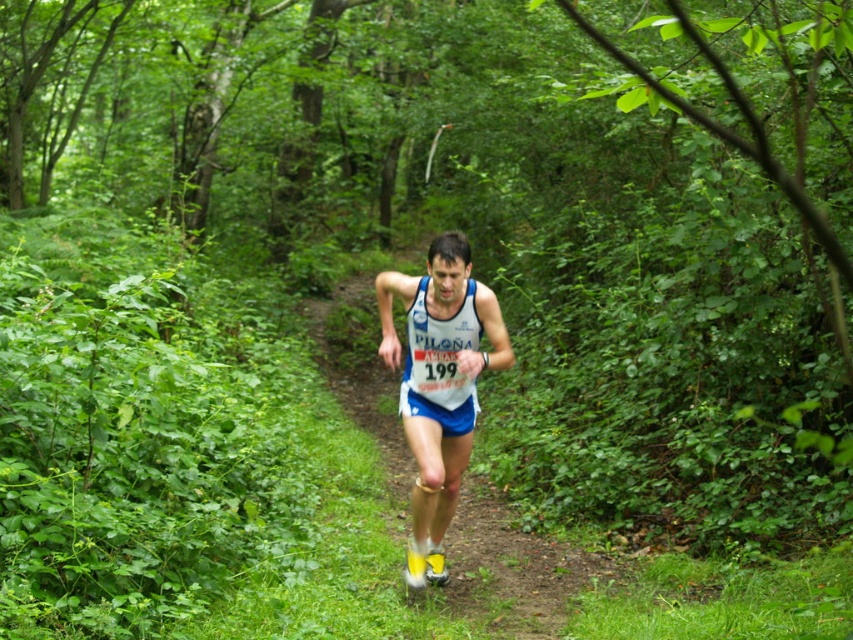
Question: Observing the image, what is the correct spatial positioning of blue fabric runner at center in reference to white fabric runner at center?

Choices:
 (A) below
 (B) above

Answer: (A)

Question: Is blue fabric runner at center wider than white fabric runner at center?

Choices:
 (A) no
 (B) yes

Answer: (B)

Question: Which point appears closest to the camera in this image?

Choices:
 (A) (502, 570)
 (B) (432, 531)

Answer: (B)

Question: Which of the following is the closest to the observer?

Choices:
 (A) (415, 285)
 (B) (509, 579)

Answer: (A)

Question: Is blue fabric runner at center positioned behind white fabric runner at center?

Choices:
 (A) no
 (B) yes

Answer: (A)